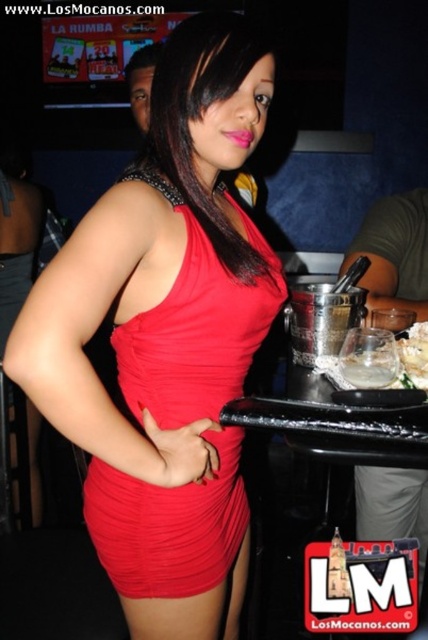
Question: Where is shiny red dress at center located in relation to shiny satin dress at center in the image?

Choices:
 (A) right
 (B) left

Answer: (B)

Question: Which point is closer to the camera?

Choices:
 (A) (137, 602)
 (B) (416, 372)

Answer: (A)

Question: Which of the following is the farthest from the observer?

Choices:
 (A) clear glass at lower right
 (B) white crumbly cake at center
 (C) shiny red dress at center
 (D) shiny satin dress at center

Answer: (B)

Question: Does shiny red dress at center appear under white crumbly cake at center?

Choices:
 (A) yes
 (B) no

Answer: (A)

Question: Is clear glass at lower right positioned before white crumbly cake at center?

Choices:
 (A) no
 (B) yes

Answer: (B)

Question: Based on their relative distances, which object is nearer to the clear glass at lower right?

Choices:
 (A) shiny satin dress at center
 (B) shiny red dress at center
 (C) white crumbly cake at center

Answer: (C)